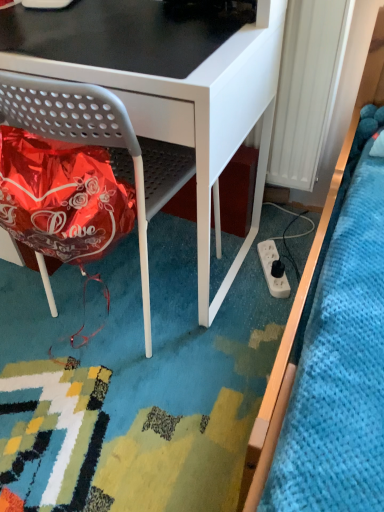
Question: Should I look upward or downward to see white plastic radiator at right?

Choices:
 (A) down
 (B) up

Answer: (B)

Question: Does white plastic power plugs and sockets at lower right lie in front of white plastic radiator at right?

Choices:
 (A) no
 (B) yes

Answer: (A)

Question: Does white plastic power plugs and sockets at lower right lie behind white plastic radiator at right?

Choices:
 (A) yes
 (B) no

Answer: (A)

Question: Is white plastic power plugs and sockets at lower right outside white plastic radiator at right?

Choices:
 (A) no
 (B) yes

Answer: (B)

Question: Does white plastic power plugs and sockets at lower right have a larger size compared to white plastic radiator at right?

Choices:
 (A) no
 (B) yes

Answer: (A)

Question: Can you confirm if white plastic power plugs and sockets at lower right is positioned to the right of white plastic radiator at right?

Choices:
 (A) yes
 (B) no

Answer: (B)

Question: Could you tell me if white plastic power plugs and sockets at lower right is turned towards white plastic radiator at right?

Choices:
 (A) yes
 (B) no

Answer: (B)

Question: Is the depth of white plastic radiator at right less than that of matte gray chair at lower left?

Choices:
 (A) yes
 (B) no

Answer: (B)

Question: Is white plastic radiator at right wider than matte gray chair at lower left?

Choices:
 (A) yes
 (B) no

Answer: (B)

Question: Would you say white plastic radiator at right is outside matte gray chair at lower left?

Choices:
 (A) yes
 (B) no

Answer: (A)

Question: Is white plastic radiator at right further to the viewer compared to matte gray chair at lower left?

Choices:
 (A) yes
 (B) no

Answer: (A)

Question: Does white plastic radiator at right have a greater height compared to matte gray chair at lower left?

Choices:
 (A) yes
 (B) no

Answer: (B)

Question: From the image's perspective, is white plastic radiator at right above matte gray chair at lower left?

Choices:
 (A) no
 (B) yes

Answer: (B)

Question: Considering the relative sizes of matte gray chair at lower left and white plastic radiator at right in the image provided, is matte gray chair at lower left thinner than white plastic radiator at right?

Choices:
 (A) no
 (B) yes

Answer: (A)